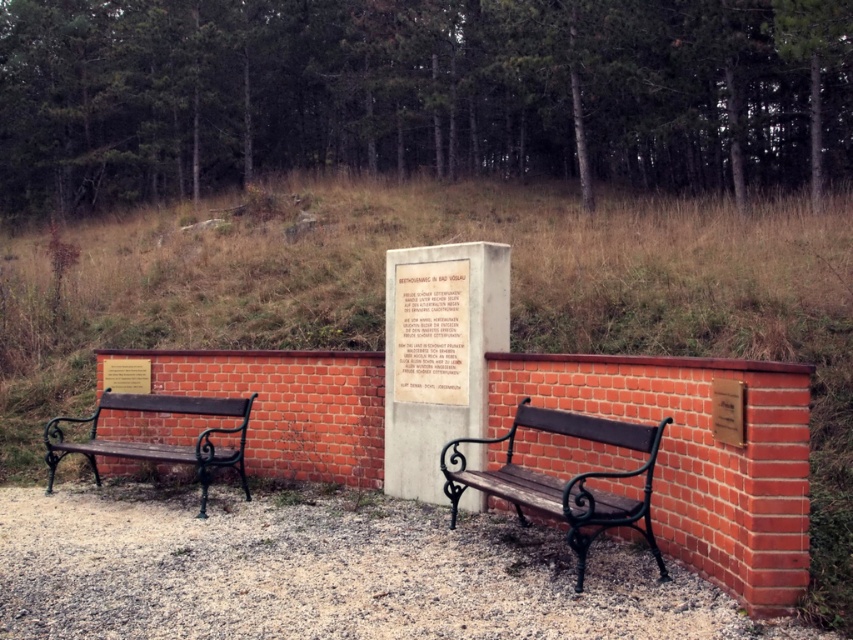
You are standing at the point with coordinates 0.5, 0.5 in the image. You want to walk to the wooden bench at center. In which direction should you move?

You should move northeast to reach the wooden bench at center because it is located at point (563, 480), which is northeast of your current position at (426, 320).

You are standing in the outdoor area and want to walk from the point at coordinates point (650, 536) to the point at coordinates point (78, 445). Which direction should you move?

You should move backward because point (650, 536) is in front of point (78, 445), so moving backward will take you towards the latter.

You are a visitor at the monument and want to sit down. You notice two benches available. Which bench has a narrower width between the wooden bench at center and the dark brown wood bench at left?

The wooden bench at center is thinner than the dark brown wood bench at left, so it has a narrower width.